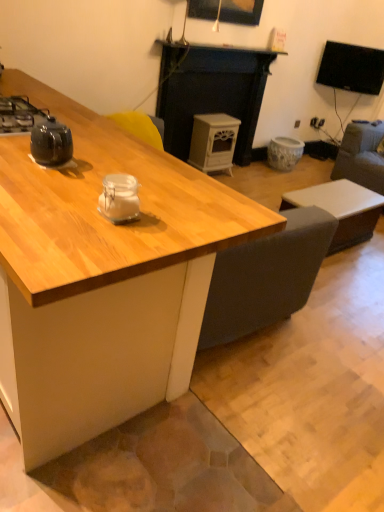
Locate an element on the screen. vacant space positioned to the left of matte black teapot at left is located at coordinates (18, 152).